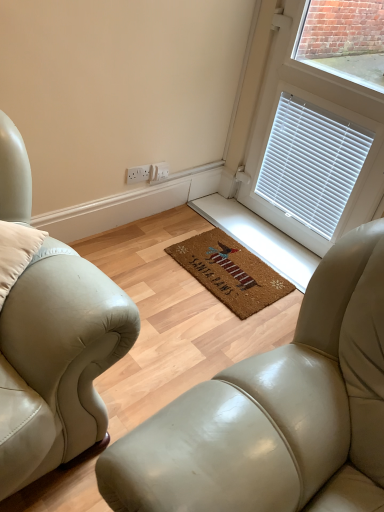
Image resolution: width=384 pixels, height=512 pixels. What are the coordinates of `vacant space behind brown coir mat at center` in the screenshot? It's located at [228, 221].